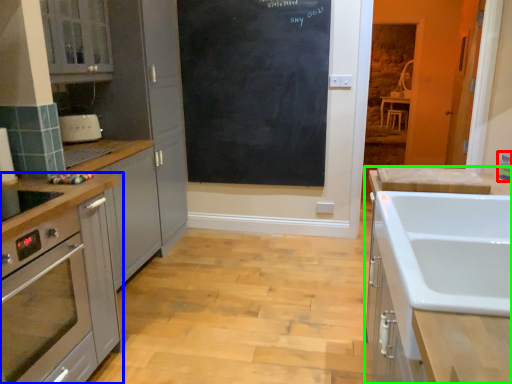
Question: Based on their relative distances, which object is nearer to appliance (highlighted by a red box)? Choose from cabinetry (highlighted by a blue box) and cabinetry (highlighted by a green box).

Choices:
 (A) cabinetry
 (B) cabinetry

Answer: (B)